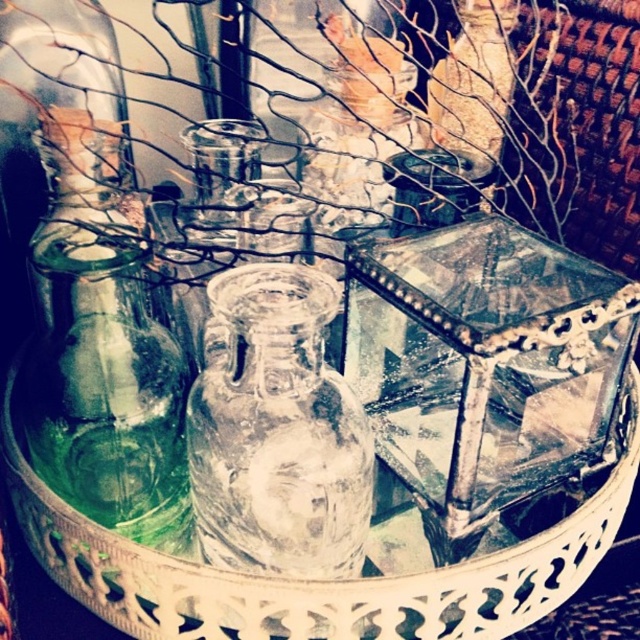
Can you confirm if green glass bottle at left is positioned to the right of transparent glass vase at center?

No, green glass bottle at left is not to the right of transparent glass vase at center.

Is point (177, 376) closer to camera compared to point (296, 333)?

No.

Who is more distant from viewer, (93, 166) or (289, 486)?

The point (93, 166) is behind.

Locate an element on the screen. The image size is (640, 640). green glass bottle at left is located at coordinates (102, 348).